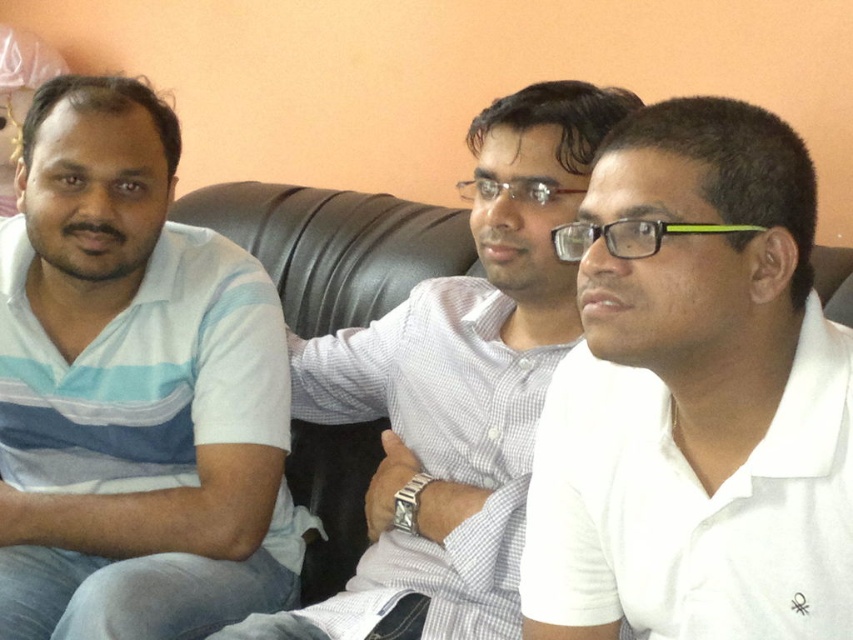
Question: From the image, what is the correct spatial relationship of blue striped polo shirt at left in relation to white checkered shirt at center?

Choices:
 (A) above
 (B) below

Answer: (B)

Question: Estimate the real-world distances between objects in this image. Which object is closer to the blue striped polo shirt at left?

Choices:
 (A) black leather couch at center
 (B) white matte shirt at center

Answer: (A)

Question: Which object is farther from the camera taking this photo?

Choices:
 (A) white matte shirt at center
 (B) white checkered shirt at center
 (C) black leather couch at center
 (D) blue striped polo shirt at left

Answer: (C)

Question: Can you confirm if white matte shirt at center is smaller than blue striped polo shirt at left?

Choices:
 (A) no
 (B) yes

Answer: (B)

Question: Among these objects, which one is nearest to the camera?

Choices:
 (A) white matte shirt at center
 (B) blue striped polo shirt at left
 (C) black leather couch at center
 (D) white checkered shirt at center

Answer: (A)

Question: Where is white matte shirt at center located in relation to white checkered shirt at center in the image?

Choices:
 (A) right
 (B) left

Answer: (A)